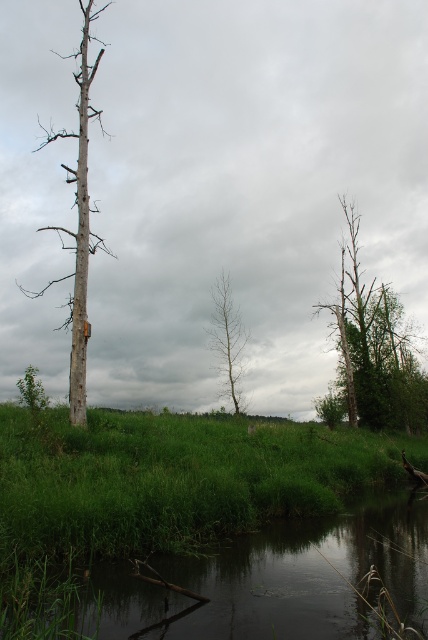
Based on the photo, which is below, green grassy at center or smooth bark tree at left?

green grassy at center is lower down.

Can you confirm if green grassy at center is wider than smooth bark tree at left?

Correct, the width of green grassy at center exceeds that of smooth bark tree at left.

Between point (380, 480) and point (82, 400), which one is positioned behind?

Point (380, 480)

I want to click on green grassy at center, so click(x=172, y=477).

Can you confirm if green grassy at center is positioned to the right of smooth bark tree at right?

No, green grassy at center is not to the right of smooth bark tree at right.

Does green grassy at center have a lesser width compared to smooth bark tree at right?

Incorrect, green grassy at center's width is not less than smooth bark tree at right's.

Find the location of `green grassy at center`. green grassy at center is located at coordinates (172, 477).

The width and height of the screenshot is (428, 640). What are the coordinates of `green grassy at center` in the screenshot? It's located at (172, 477).

Is green grassy at center shorter than bare wood tree at center?

No.

Does green grassy at center have a smaller size compared to bare wood tree at center?

No, green grassy at center is not smaller than bare wood tree at center.

I want to click on green grassy at center, so click(x=172, y=477).